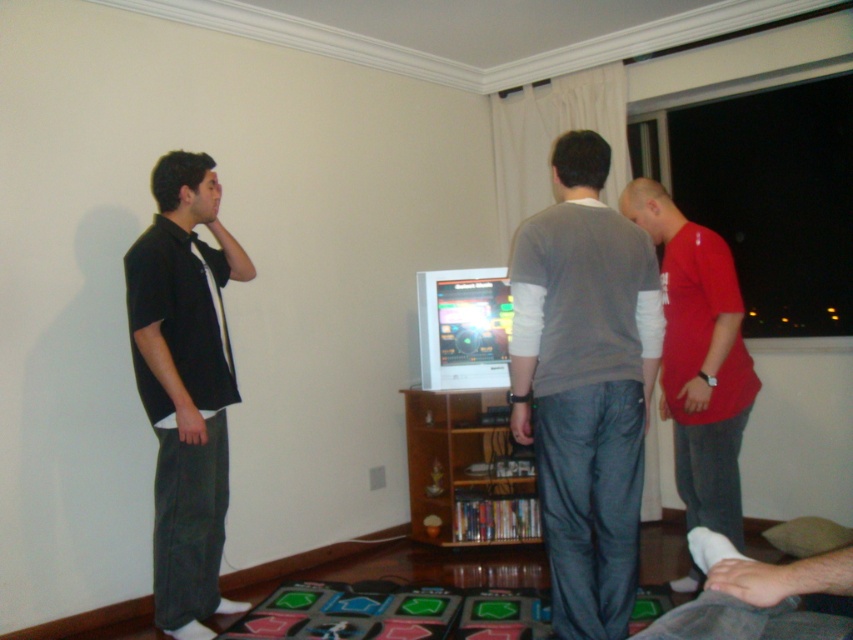
Is black cotton shirt at left above red matte t-shirt at center?

Incorrect, black cotton shirt at left is not positioned above red matte t-shirt at center.

In the scene shown: Is black cotton shirt at left positioned before red matte t-shirt at center?

Yes, it is in front of red matte t-shirt at center.

Who is more distant from viewer, (196, 547) or (686, 586)?

Positioned behind is point (686, 586).

Identify the location of black cotton shirt at left. The image size is (853, 640). (184, 385).

Does gray cotton shirt at center have a lesser height compared to red matte t-shirt at center?

Indeed, gray cotton shirt at center has a lesser height compared to red matte t-shirt at center.

Between point (520, 262) and point (705, 241), which one is positioned behind?

The point (705, 241) is more distant.

Consider the image. Who is more forward, (573,404) or (694,243)?

Point (573,404) is more forward.

Find the location of `gray cotton shirt at center`. gray cotton shirt at center is located at coordinates (585, 385).

Is gray cotton shirt at center taller than black cotton shirt at left?

No.

Is gray cotton shirt at center bigger than black cotton shirt at left?

No, gray cotton shirt at center is not bigger than black cotton shirt at left.

The width and height of the screenshot is (853, 640). Identify the location of gray cotton shirt at center. (585, 385).

Where is `gray cotton shirt at center`? This screenshot has width=853, height=640. gray cotton shirt at center is located at coordinates (585, 385).